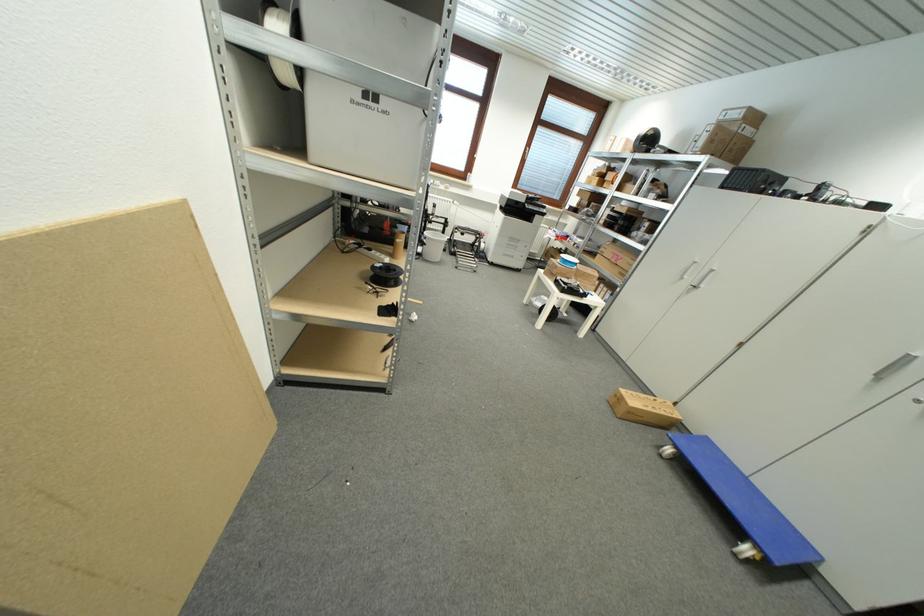
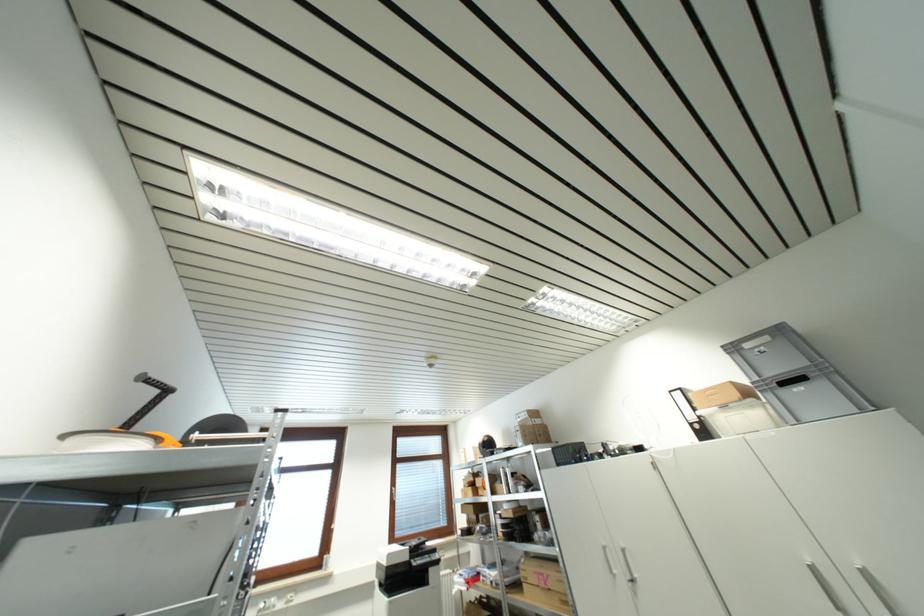
The images are taken continuously from a first-person perspective. In which direction is your viewpoint rotating?

The camera's rotation is toward right-up.